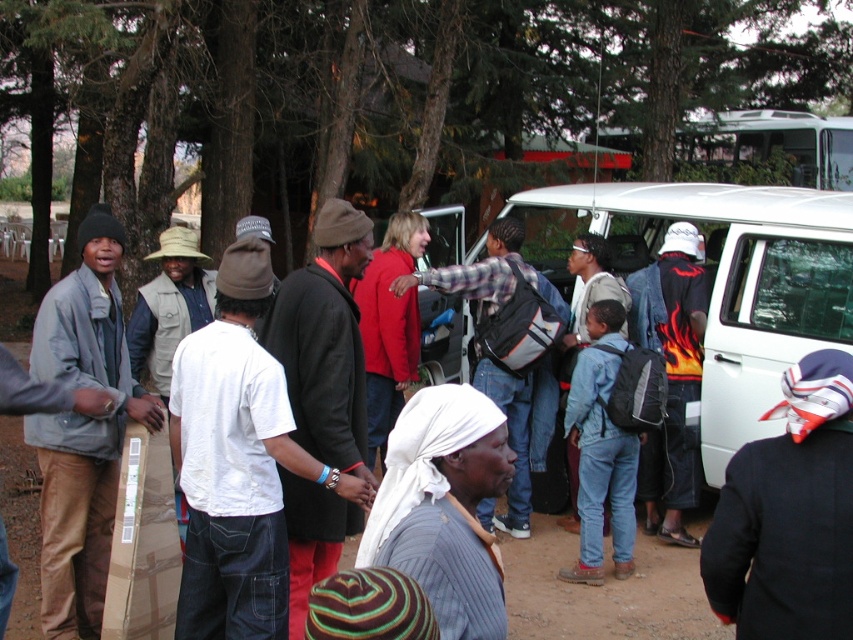
You are a photographer setting up a backdrop for a group photo. You need to ensure that the matte gray jacket at left and the denim jeans at center won

The matte gray jacket at left might be wider than the denim jeans at center, so you should position the backdrop slightly wider to accommodate the potential width difference between the matte gray jacket at left and the denim jeans at center.

You are organizing a charity event and need to pack items into a storage box. The box can only hold items that are smaller than the denim jeans at center. Can the black leather jacket at center fit into the box?

The black leather jacket at center is bigger than the denim jeans at center, so it cannot fit into the storage box since it exceeds the size limit.